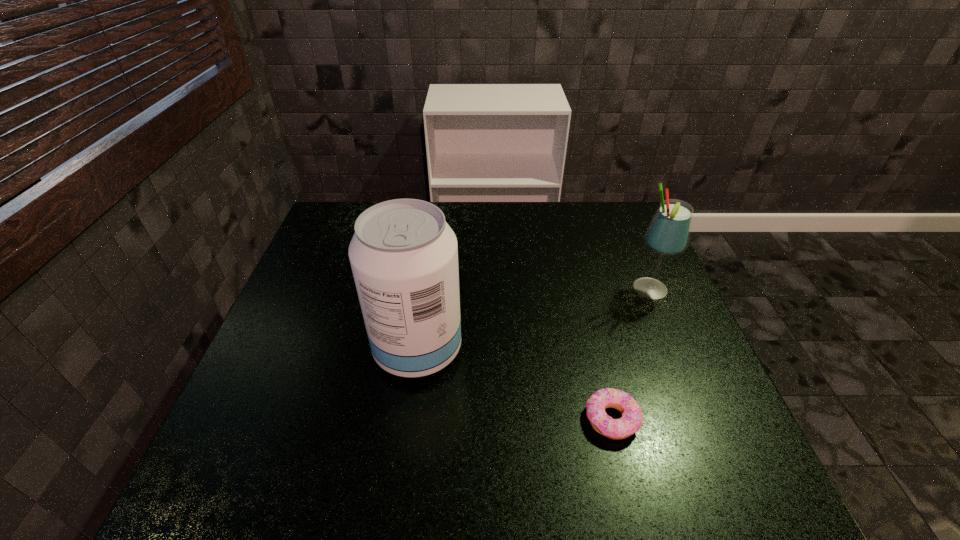
In the image, there is a desktop. Identify the location of free space at the far edge. The image size is (960, 540). (523, 226).

This screenshot has height=540, width=960. In the image, there is a desktop. What are the coordinates of `vacant space at the near edge` in the screenshot? It's located at (583, 508).

In order to click on vacant space at the left edge of the desktop in this screenshot , I will do `click(279, 449)`.

This screenshot has width=960, height=540. Identify the location of vacant space at the right edge. (706, 423).

At what (x,y) coordinates should I click in order to perform the action: click on empty location between the leftmost object and the shortest object. Please return your answer as a coordinate pair (x, y). Looking at the image, I should click on (515, 384).

This screenshot has width=960, height=540. I want to click on vacant space that is in between the rightmost object and the second farthest object, so click(534, 320).

Locate an element on the screen. The height and width of the screenshot is (540, 960). vacant space that is in between the nearest object and the left alcohol is located at coordinates (515, 384).

Image resolution: width=960 pixels, height=540 pixels. I want to click on free space between the nearer alcohol and the rightmost object, so click(534, 320).

The width and height of the screenshot is (960, 540). Identify the location of free spot between the nearer alcohol and the doughnut. point(515,384).

At what (x,y) coordinates should I click in order to perform the action: click on vacant point located between the nearer alcohol and the farther alcohol. Please return your answer as a coordinate pair (x, y). Looking at the image, I should click on (534, 320).